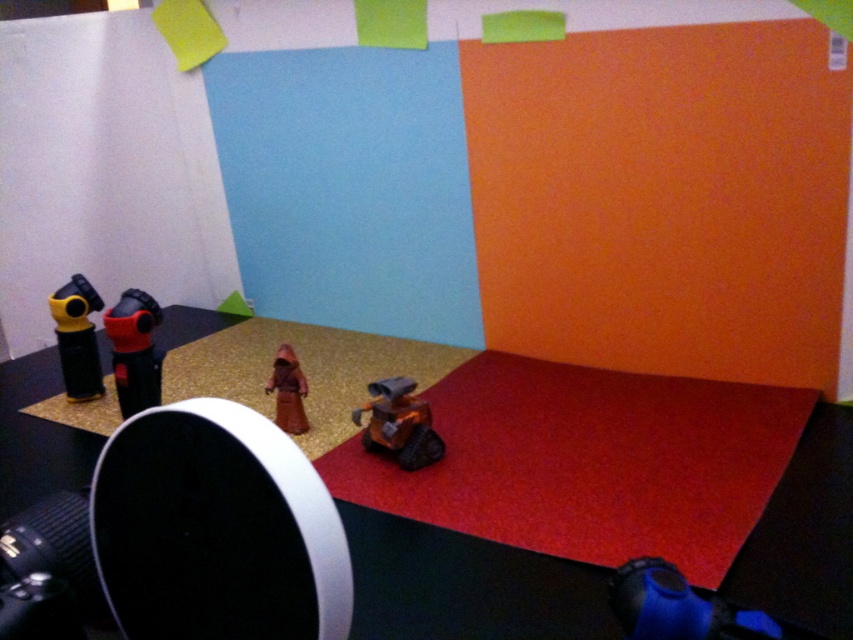
Question: Which of these objects is positioned closest to the matte brown robe at center?

Choices:
 (A) matte black camera at left
 (B) yellow plastic camera at left
 (C) orange matte robot at lower center
 (D) gold textured carpet at center

Answer: (C)

Question: Is matte black camera at left smaller than orange matte robot at lower center?

Choices:
 (A) yes
 (B) no

Answer: (B)

Question: Which of the following is the farthest from the observer?

Choices:
 (A) (408, 397)
 (B) (136, 394)
 (C) (291, 417)
 (D) (416, 246)

Answer: (D)

Question: Does gold textured carpet at center have a larger size compared to matte black camera at left?

Choices:
 (A) no
 (B) yes

Answer: (B)

Question: Is matte black camera at left above orange matte robot at lower center?

Choices:
 (A) yes
 (B) no

Answer: (A)

Question: Based on their relative distances, which object is farther from the gold textured carpet at center?

Choices:
 (A) orange matte robot at lower center
 (B) matte brown robe at center

Answer: (B)